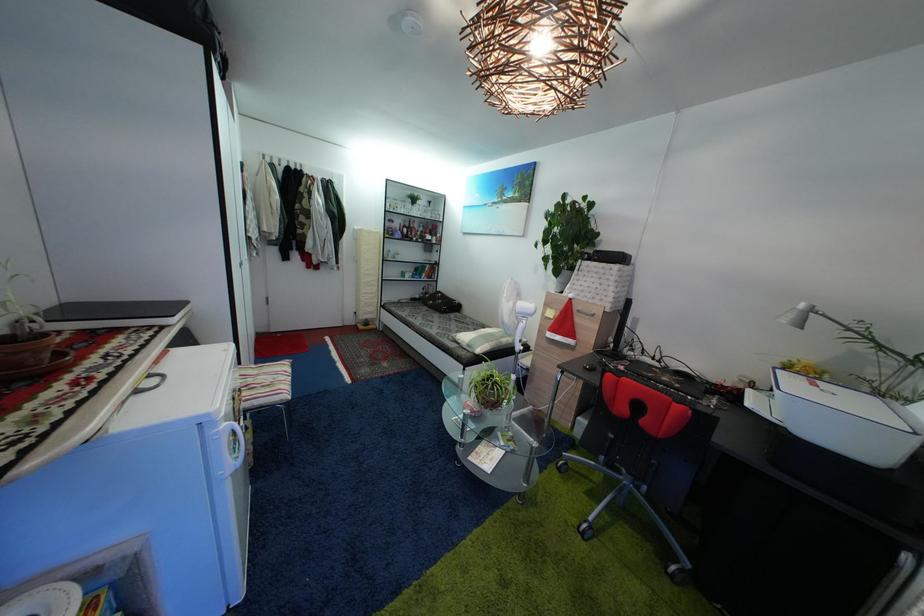
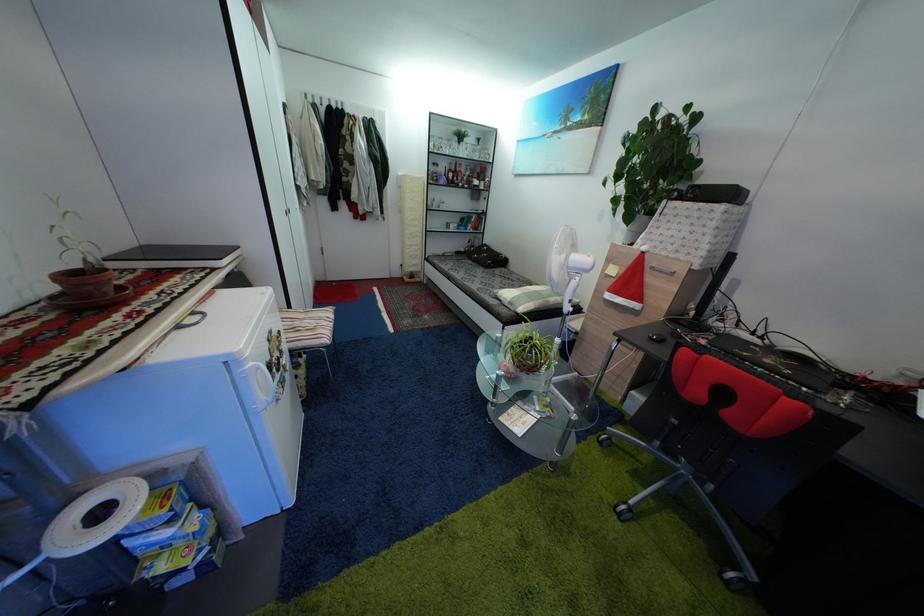
Looking at this image, what movement of the cameraman would produce the second image?

The cameraman walked toward right, forward.